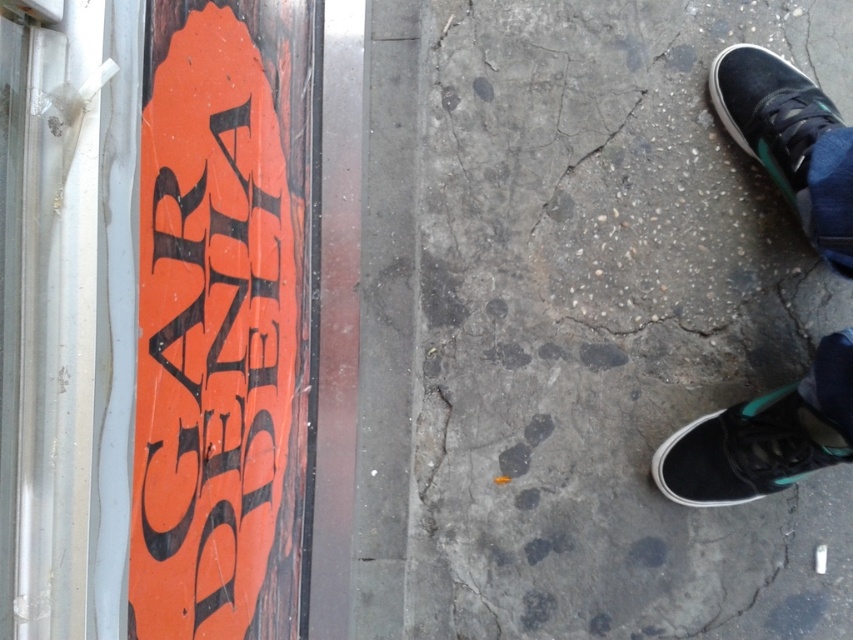
You are a delivery person standing on the sidewalk and need to place a package on the gray concrete pavement at center. The black canvas shoe at upper right is in the way. Can you move the shoe to the side to make space?

The gray concrete pavement at center is much taller than the black canvas shoe at upper right, so you can move the shoe to the side to make space because the pavement is higher.